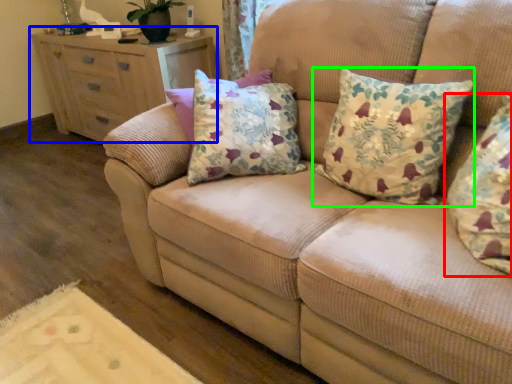
Question: Which object is the closest to the pillow (highlighted by a red box)? Choose among these: chest of drawers (highlighted by a blue box) or pillow (highlighted by a green box).

Choices:
 (A) chest of drawers
 (B) pillow

Answer: (B)